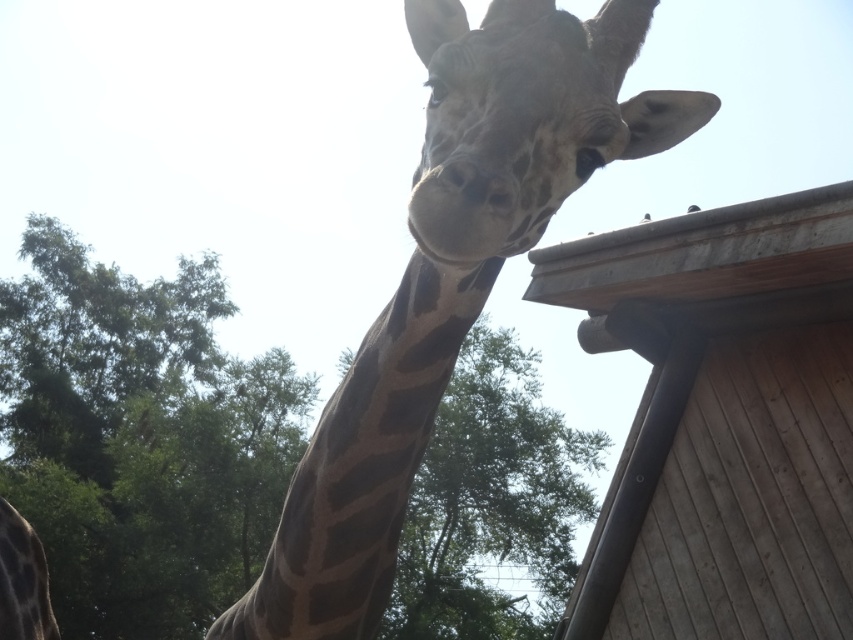
Question: Which of the following is the farthest from the observer?

Choices:
 (A) wooden hut at upper right
 (B) spotted fur giraffe at center
 (C) green leafy tree at upper left

Answer: (C)

Question: Is wooden hut at upper right thinner than spotted fur giraffe at center?

Choices:
 (A) yes
 (B) no

Answer: (B)

Question: Does wooden hut at upper right appear under spotted fur giraffe at center?

Choices:
 (A) no
 (B) yes

Answer: (B)

Question: Can you confirm if green leafy tree at upper left is wider than spotted fur giraffe at center?

Choices:
 (A) yes
 (B) no

Answer: (A)

Question: Estimate the real-world distances between objects in this image. Which object is closer to the green leafy tree at upper left?

Choices:
 (A) wooden hut at upper right
 (B) spotted fur giraffe at center

Answer: (A)

Question: Among these objects, which one is nearest to the camera?

Choices:
 (A) green leafy tree at upper left
 (B) wooden hut at upper right
 (C) spotted fur giraffe at center

Answer: (C)